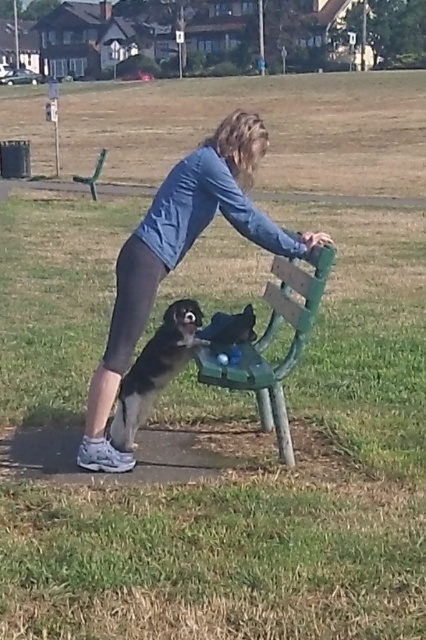
You are a photographer setting up a shot of the woman and her dog near the green wooden bench at center. You notice the blue denim jacket at upper center might be distracting. Since you can only move one object, which one should you move to avoid blocking the view of the bench?

You should move the blue denim jacket at upper center because it is larger than the green wooden bench at center and might be blocking the view more significantly.

You are a park visitor who wants to sit on the green wooden bench at center. However, there is a blue denim jacket at upper center on the bench. Can you sit there without moving the jacket?

The blue denim jacket at upper center might be wider than the green wooden bench at center, so there might not be enough space for you to sit without moving the jacket.

You are a park visitor who wants to place a blue denim jacket at upper center onto the green wooden bench at center. Is the jacket currently positioned in a way that allows you to easily reach it from the bench?

The blue denim jacket at upper center is above the green wooden bench at center, so you can easily reach it from the bench.